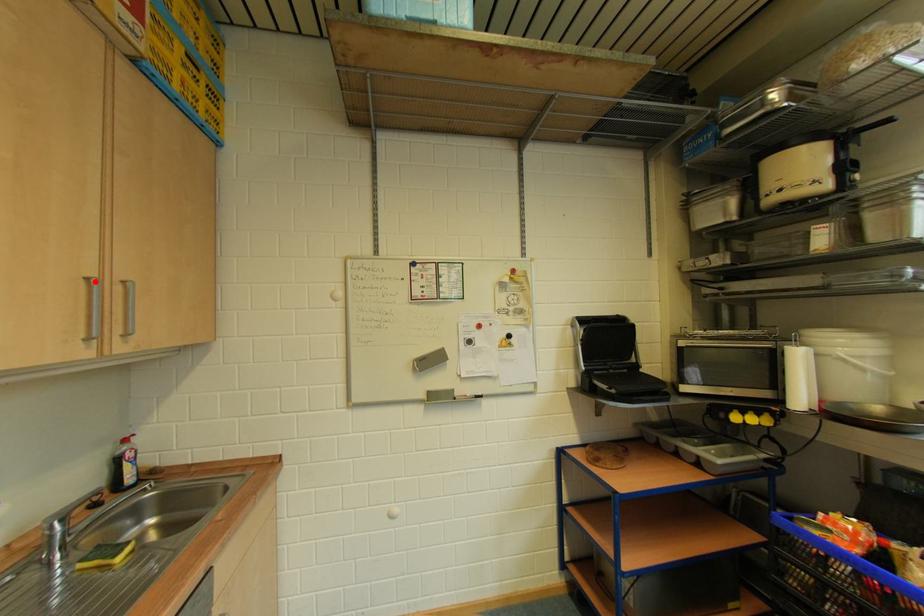
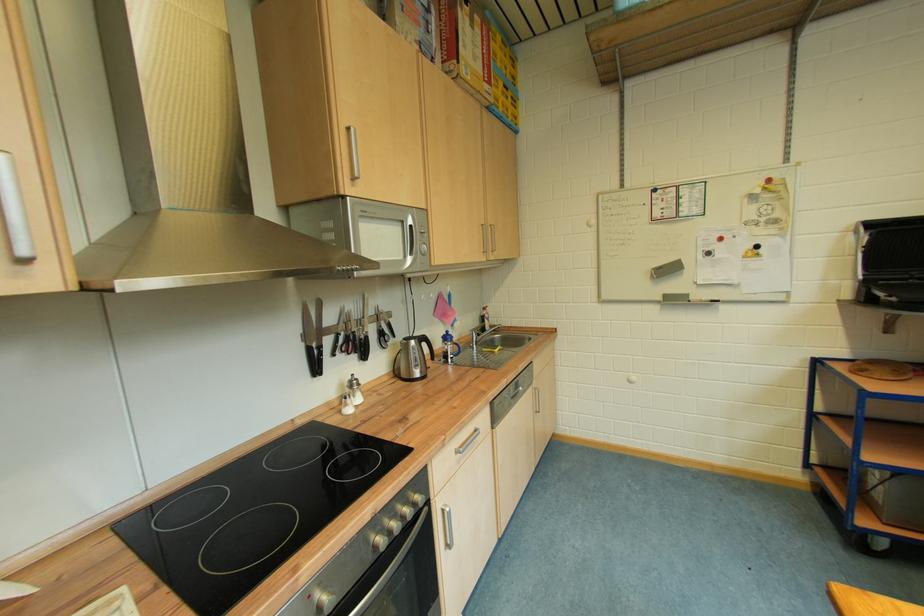
Where in the second image is the point corresponding to the highlighted location from the first image?

(490, 228)